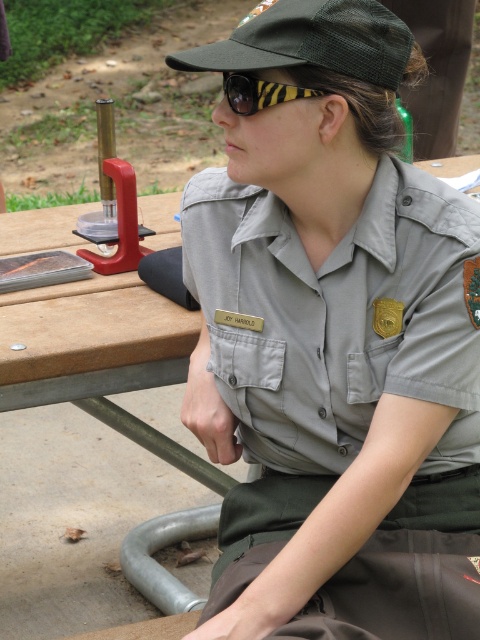
How far apart are gray fabric uniform at center and black striped goggles at upper center?

A distance of 24.03 inches exists between gray fabric uniform at center and black striped goggles at upper center.

Which of these two, gray fabric uniform at center or black striped goggles at upper center, stands taller?

gray fabric uniform at center

This screenshot has width=480, height=640. What are the coordinates of `gray fabric uniform at center` in the screenshot? It's located at (340, 364).

Image resolution: width=480 pixels, height=640 pixels. Identify the location of gray fabric uniform at center. (340, 364).